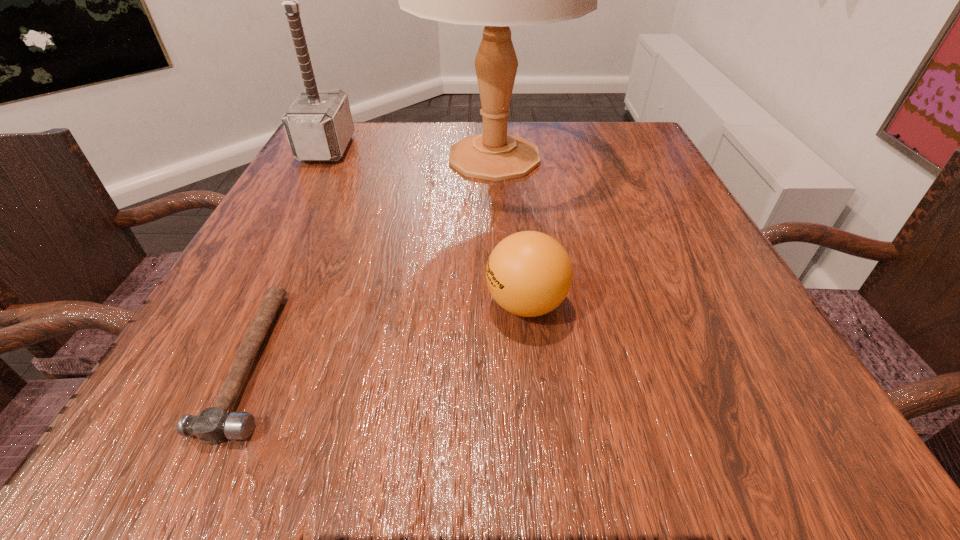
I want to click on vacant region at the right edge of the desktop, so click(x=670, y=177).

The width and height of the screenshot is (960, 540). In order to click on vacant point at the far left corner in this screenshot , I will do `click(345, 156)`.

In the image, there is a desktop. Where is `vacant region at the far right corner`? This screenshot has height=540, width=960. vacant region at the far right corner is located at coordinates (637, 126).

The image size is (960, 540). Identify the location of free space at the near right corner of the desktop. (713, 444).

Find the location of `vacant point located between the tallest object and the taller hammer`. vacant point located between the tallest object and the taller hammer is located at coordinates (411, 153).

Locate an element on the screen. vacant space that's between the tallest object and the ping-pong ball is located at coordinates (510, 231).

This screenshot has width=960, height=540. In order to click on free point between the tallest object and the taller hammer in this screenshot , I will do (411, 153).

This screenshot has height=540, width=960. In order to click on free space between the tallest object and the nearer hammer in this screenshot , I will do coord(373,259).

Where is `blank region between the nearer hammer and the second shortest object`? blank region between the nearer hammer and the second shortest object is located at coordinates (389, 332).

This screenshot has width=960, height=540. I want to click on free space between the third shortest object and the table lamp, so click(411, 153).